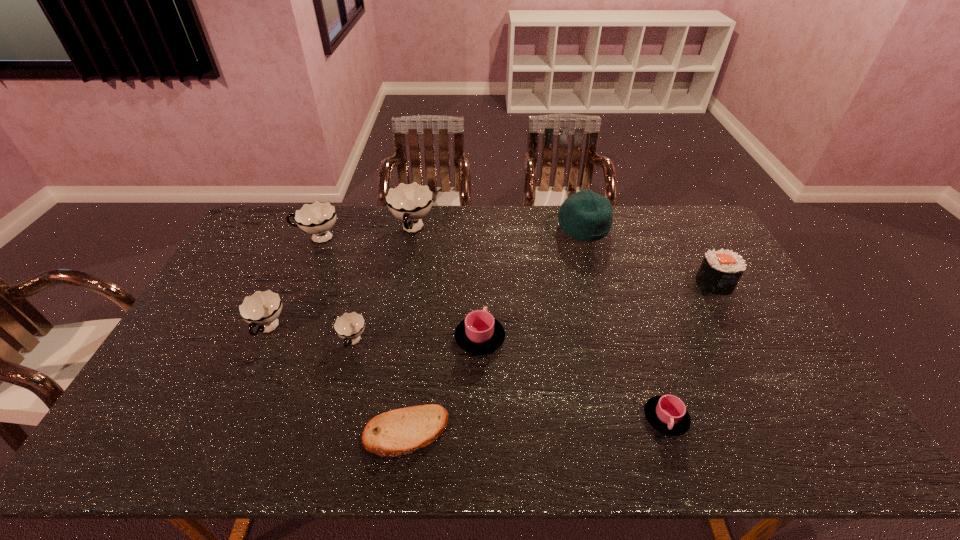
Where is `the right pink cup`? The height and width of the screenshot is (540, 960). the right pink cup is located at coordinates (667, 414).

This screenshot has height=540, width=960. Find the location of `the shortest object`. the shortest object is located at coordinates (398, 432).

Find the location of a particular element. This screenshot has width=960, height=540. vacant point located on the left of the beanie is located at coordinates (488, 228).

Image resolution: width=960 pixels, height=540 pixels. Identify the location of vacant space located 0.090m on the side of the biggest white cup with the handle. (406, 266).

Where is `vacant space located on the side of the third smallest white cup with the handle`? vacant space located on the side of the third smallest white cup with the handle is located at coordinates (274, 239).

Where is `free spot located 0.120m on the side of the third smallest white cup with the handle`? This screenshot has height=540, width=960. free spot located 0.120m on the side of the third smallest white cup with the handle is located at coordinates click(259, 239).

At what (x,y) coordinates should I click in order to perform the action: click on blank space located 0.180m on the back of the sushi. Please return your answer as a coordinate pair (x, y). The width and height of the screenshot is (960, 540). Looking at the image, I should click on (689, 238).

You are a GUI agent. You are given a task and a screenshot of the screen. Output one action in this format:
    pyautogui.click(x=<x>, y=<y>)
    Task: Click on the free space located on the side of the fourth shortest cup with the handle
    The image size is (960, 540).
    Given the screenshot: What is the action you would take?
    pyautogui.click(x=239, y=393)

Find the location of `free space located on the side of the smallest white cup with the handle`. free space located on the side of the smallest white cup with the handle is located at coordinates (324, 453).

Identify the location of vacant area situated on the side with the handle of the left pink cup. This screenshot has width=960, height=540. (480, 258).